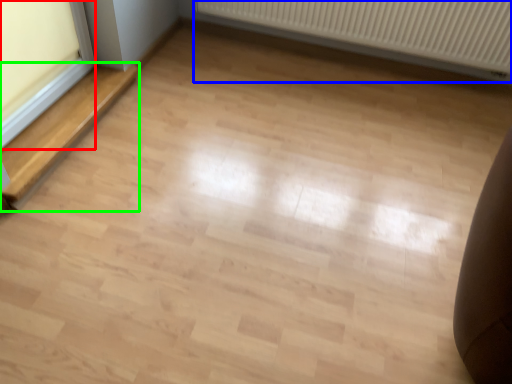
Question: Considering the real-world distances, which object is closest to window frame (highlighted by a red box)? radiator (highlighted by a blue box) or stairwell (highlighted by a green box).

Choices:
 (A) radiator
 (B) stairwell

Answer: (B)